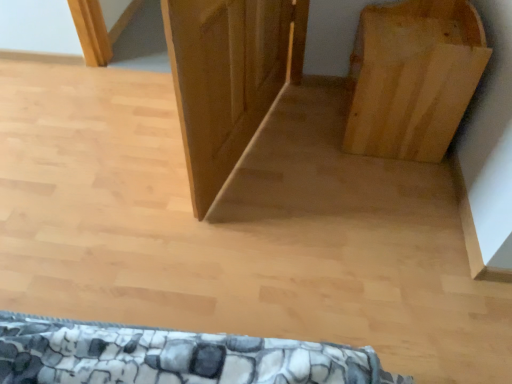
Locate an element on the screen. This screenshot has width=512, height=384. space that is in front of wooden door at center is located at coordinates (190, 256).